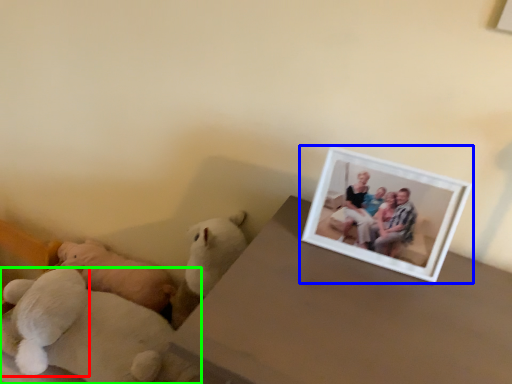
Question: Which object is positioned closest to teddy bear (highlighted by a red box)? Select from picture frame (highlighted by a blue box) and teddy bear (highlighted by a green box).

Choices:
 (A) picture frame
 (B) teddy bear

Answer: (B)